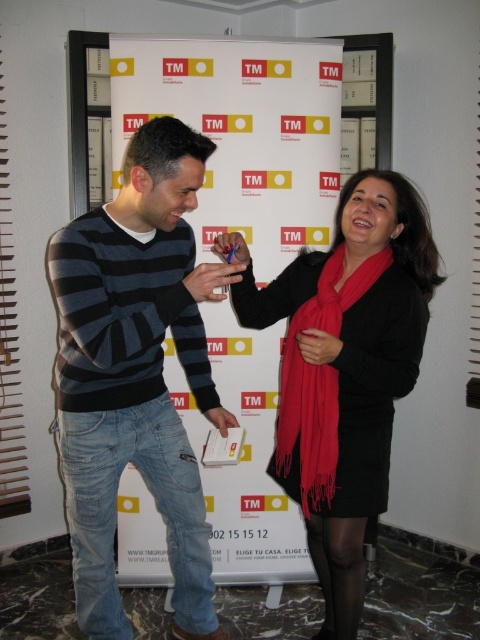
Between matte black dress at center and red woolen scarf at center, which one is positioned higher?

red woolen scarf at center is above.

Does point (412, 348) lie behind point (294, 346)?

No, (412, 348) is closer to viewer.

Between point (328, 435) and point (361, 280), which one is positioned behind?

Point (361, 280)

Locate an element on the screen. This screenshot has width=480, height=640. matte black dress at center is located at coordinates (348, 372).

Between point (300, 326) and point (218, 250), which one is positioned behind?

Positioned behind is point (300, 326).

Who is positioned more to the right, red woolen scarf at center or blue plastic pen at center?

From the viewer's perspective, red woolen scarf at center appears more on the right side.

Locate an element on the screen. This screenshot has width=480, height=640. red woolen scarf at center is located at coordinates (317, 381).

Which is behind, point (239, 248) or point (216, 424)?

The point (216, 424) is more distant.

Does blue plastic pen at center come in front of matte white book at center?

Yes.

The image size is (480, 640). I want to click on blue plastic pen at center, so click(230, 248).

Identify the location of blue plastic pen at center. This screenshot has width=480, height=640. (230, 248).